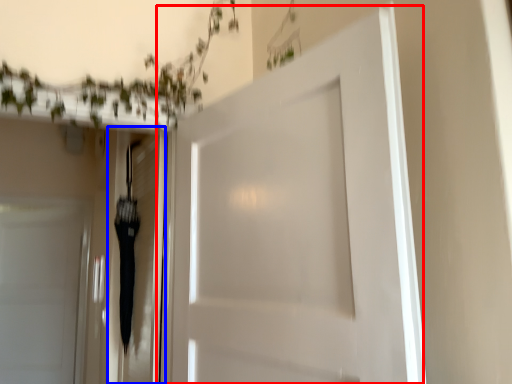
Question: Among these objects, which one is nearest to the camera, door (highlighted by a red box) or elevator (highlighted by a blue box)?

Choices:
 (A) door
 (B) elevator

Answer: (A)